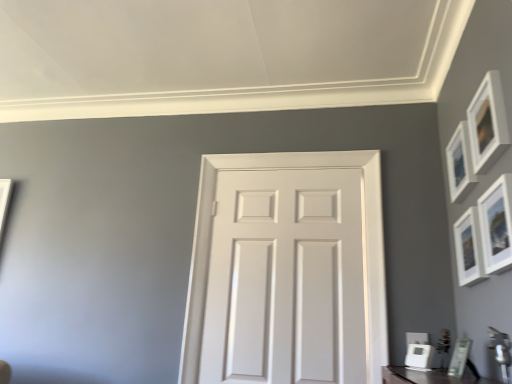
Describe the element at coordinates (364, 233) in the screenshot. I see `white matte door at center` at that location.

Image resolution: width=512 pixels, height=384 pixels. What do you see at coordinates (487, 123) in the screenshot? I see `matte white picture frame at upper right, the first picture frame when ordered from top to bottom` at bounding box center [487, 123].

The image size is (512, 384). What do you see at coordinates (460, 164) in the screenshot?
I see `matte white picture frame at upper right, which is counted as the 5th picture frame, starting from the bottom` at bounding box center [460, 164].

Identify the location of matte white picture frame at lower right, which ranks as the second picture frame in bottom-to-top order. (459, 358).

From the image's perspective, is white matte picture frame at upper right, the fourth picture frame positioned from the top, on matte white picture frame at upper right, arranged as the third picture frame when viewed from the top?

No.

From the matte white picture frame at upper right, arranged as the third picture frame when viewed from the top, count 2nd picture frame to the right and point to it. Please provide its 2D coordinates.

[(468, 249)]

From the image's perspective, which picture frame is the 2nd one above the matte white picture frame at lower right, which ranks as the fifth picture frame in top-to-bottom order? Please provide its 2D coordinates.

[(497, 225)]

Looking at the image, does matte white picture frame at lower right, which ranks as the second picture frame in bottom-to-top order, seem bigger or smaller compared to matte white picture frame at upper right, arranged as the third picture frame when viewed from the top?

Clearly, matte white picture frame at lower right, which ranks as the second picture frame in bottom-to-top order, is smaller in size than matte white picture frame at upper right, arranged as the third picture frame when viewed from the top.

From a real-world perspective, is matte white picture frame at lower right, which ranks as the fifth picture frame in top-to-bottom order, positioned above or below matte white picture frame at upper right, which ranks as the fourth picture frame in bottom-to-top order?

In terms of real-world spatial position, matte white picture frame at lower right, which ranks as the fifth picture frame in top-to-bottom order, is below matte white picture frame at upper right, which ranks as the fourth picture frame in bottom-to-top order.

Which object is thinner, matte white picture frame at lower right, which ranks as the second picture frame in bottom-to-top order, or matte white picture frame at upper right, arranged as the third picture frame when viewed from the top?

With smaller width is matte white picture frame at upper right, arranged as the third picture frame when viewed from the top.

Considering the points (462, 231) and (456, 352), which point is behind, point (462, 231) or point (456, 352)?

The point (456, 352) is behind.

Is white matte picture frame at upper right, the fourth picture frame positioned from the top, taller or shorter than matte white picture frame at lower right, which ranks as the fifth picture frame in top-to-bottom order?

In the image, white matte picture frame at upper right, the fourth picture frame positioned from the top, appears to be taller than matte white picture frame at lower right, which ranks as the fifth picture frame in top-to-bottom order.

Considering the relative sizes of white matte picture frame at upper right, the fourth picture frame positioned from the top, and matte white picture frame at lower right, which ranks as the second picture frame in bottom-to-top order, in the image provided, is white matte picture frame at upper right, the fourth picture frame positioned from the top, bigger than matte white picture frame at lower right, which ranks as the second picture frame in bottom-to-top order,?

Indeed, white matte picture frame at upper right, the fourth picture frame positioned from the top, has a larger size compared to matte white picture frame at lower right, which ranks as the second picture frame in bottom-to-top order.

Is matte white picture frame at upper right, arranged as the third picture frame when viewed from the top, oriented away from white matte picture frame at upper right, the fourth picture frame positioned from the top?

No, matte white picture frame at upper right, arranged as the third picture frame when viewed from the top, is not facing the opposite direction of white matte picture frame at upper right, the fourth picture frame positioned from the top.

There is a white matte picture frame at upper right, which is the third picture frame from bottom to top. Where is `the 1st picture frame below it (from a real-world perspective)`? This screenshot has height=384, width=512. the 1st picture frame below it (from a real-world perspective) is located at coordinates (497, 225).

From a real-world perspective, is matte white picture frame at upper right, which ranks as the fourth picture frame in bottom-to-top order, positioned over white matte picture frame at upper right, the fourth picture frame positioned from the top, based on gravity?

No, from a real-world perspective, matte white picture frame at upper right, which ranks as the fourth picture frame in bottom-to-top order, is not on top of white matte picture frame at upper right, the fourth picture frame positioned from the top.

Is white matte picture frame at upper right, the fourth picture frame positioned from the top, aimed at white matte door at center?

Yes.

Between white matte picture frame at upper right, the fourth picture frame positioned from the top, and white matte door at center, which one has smaller width?

white matte door at center is thinner.

Is white matte picture frame at upper right, which is the third picture frame from bottom to top, placed right next to white matte door at center?

There is a gap between white matte picture frame at upper right, which is the third picture frame from bottom to top, and white matte door at center.

Does point (407, 350) appear closer or farther from the camera than point (463, 273)?

Point (407, 350).

Is white glossy picture frame at lower right, which is counted as the 1th picture frame, starting from the bottom, facing away from white matte picture frame at upper right, the fourth picture frame positioned from the top?

That's not correct — white glossy picture frame at lower right, which is counted as the 1th picture frame, starting from the bottom, is not looking away from white matte picture frame at upper right, the fourth picture frame positioned from the top.

This screenshot has height=384, width=512. What are the coordinates of `the 4th picture frame counting from the left side of the white matte picture frame at upper right, which is the third picture frame from bottom to top` in the screenshot? It's located at (419, 357).

Measure the distance from white glossy picture frame at lower right, which is counted as the 1th picture frame, starting from the bottom, to white matte picture frame at upper right, the fourth picture frame positioned from the top.

white glossy picture frame at lower right, which is counted as the 1th picture frame, starting from the bottom, is 15.79 inches away from white matte picture frame at upper right, the fourth picture frame positioned from the top.

Can matte white picture frame at lower right, which ranks as the second picture frame in bottom-to-top order, be found inside matte white picture frame at upper right, arranged as the third picture frame when viewed from the top?

Definitely not — matte white picture frame at lower right, which ranks as the second picture frame in bottom-to-top order, is not inside matte white picture frame at upper right, arranged as the third picture frame when viewed from the top.

Consider the image. Can you confirm if matte white picture frame at upper right, arranged as the third picture frame when viewed from the top, is taller than matte white picture frame at lower right, which ranks as the fifth picture frame in top-to-bottom order?

Yes, matte white picture frame at upper right, arranged as the third picture frame when viewed from the top, is taller than matte white picture frame at lower right, which ranks as the fifth picture frame in top-to-bottom order.

From a real-world perspective, is matte white picture frame at upper right, which ranks as the fourth picture frame in bottom-to-top order, above or below matte white picture frame at lower right, which ranks as the second picture frame in bottom-to-top order?

In terms of real-world spatial position, matte white picture frame at upper right, which ranks as the fourth picture frame in bottom-to-top order, is above matte white picture frame at lower right, which ranks as the second picture frame in bottom-to-top order.

Locate an element on the screen. Image resolution: width=512 pixels, height=384 pixels. picture frame that is the 1st object directly below the matte white picture frame at upper right, arranged as the third picture frame when viewed from the top (from a real-world perspective) is located at coordinates (459, 358).

Starting from the matte white picture frame at upper right, which ranks as the fourth picture frame in bottom-to-top order, which picture frame is the 3rd one behind? Please provide its 2D coordinates.

[(468, 249)]

From a real-world perspective, starting from the matte white picture frame at lower right, which ranks as the second picture frame in bottom-to-top order, which picture frame is the 1st one vertically above it? Please provide its 2D coordinates.

[(497, 225)]

From the image, which object appears to be nearer to matte white picture frame at lower right, which ranks as the fifth picture frame in top-to-bottom order, matte white picture frame at upper right, arranged as the sixth picture frame when ordered from the bottom, or white matte door at center?

Based on the image, white matte door at center appears to be nearer to matte white picture frame at lower right, which ranks as the fifth picture frame in top-to-bottom order.

Which object lies further to the anchor point matte white picture frame at upper right, which is counted as the 5th picture frame, starting from the bottom, white matte door at center or white glossy picture frame at lower right, which is counted as the 1th picture frame, starting from the bottom?

white glossy picture frame at lower right, which is counted as the 1th picture frame, starting from the bottom, is further to matte white picture frame at upper right, which is counted as the 5th picture frame, starting from the bottom.

Considering their positions, is matte white picture frame at upper right, which ranks as the fourth picture frame in bottom-to-top order, positioned further to white matte picture frame at upper right, which is the third picture frame from bottom to top, than matte white picture frame at upper right, which is counted as the second picture frame, starting from the top?

The object further to white matte picture frame at upper right, which is the third picture frame from bottom to top, is matte white picture frame at upper right, which is counted as the second picture frame, starting from the top.

From the image, which object appears to be farther from matte white picture frame at upper right, arranged as the third picture frame when viewed from the top, white glossy picture frame at lower right, which is counted as the 1th picture frame, starting from the bottom, or white matte door at center?

The object further to matte white picture frame at upper right, arranged as the third picture frame when viewed from the top, is white matte door at center.

Based on their spatial positions, is matte white picture frame at upper right, arranged as the third picture frame when viewed from the top, or white glossy picture frame at lower right, the sixth picture frame viewed from the top, closer to matte white picture frame at lower right, which ranks as the second picture frame in bottom-to-top order?

white glossy picture frame at lower right, the sixth picture frame viewed from the top, is closer to matte white picture frame at lower right, which ranks as the second picture frame in bottom-to-top order.

Looking at the image, which one is located closer to matte white picture frame at lower right, which ranks as the second picture frame in bottom-to-top order, white matte picture frame at upper right, which is the third picture frame from bottom to top, or matte white picture frame at upper right, which is counted as the second picture frame, starting from the top?

white matte picture frame at upper right, which is the third picture frame from bottom to top, is closer to matte white picture frame at lower right, which ranks as the second picture frame in bottom-to-top order.

Considering their positions, is matte white picture frame at upper right, the first picture frame when ordered from top to bottom, positioned closer to white matte door at center than matte white picture frame at upper right, which ranks as the fourth picture frame in bottom-to-top order?

matte white picture frame at upper right, which ranks as the fourth picture frame in bottom-to-top order, is closer to white matte door at center.

Consider the image. Estimate the real-world distances between objects in this image. Which object is further from matte white picture frame at upper right, arranged as the third picture frame when viewed from the top, white matte picture frame at upper right, which is the third picture frame from bottom to top, or matte white picture frame at upper right, which is counted as the second picture frame, starting from the top?

matte white picture frame at upper right, which is counted as the second picture frame, starting from the top, is positioned further to the anchor matte white picture frame at upper right, arranged as the third picture frame when viewed from the top.

Image resolution: width=512 pixels, height=384 pixels. Find the location of `door that lies between matte white picture frame at upper right, the first picture frame when ordered from top to bottom, and white glossy picture frame at lower right, the sixth picture frame viewed from the top, from top to bottom`. door that lies between matte white picture frame at upper right, the first picture frame when ordered from top to bottom, and white glossy picture frame at lower right, the sixth picture frame viewed from the top, from top to bottom is located at coordinates coord(364,233).

Locate an element on the screen. picture frame between white matte picture frame at upper right, which is the third picture frame from bottom to top, and white glossy picture frame at lower right, which is counted as the 1th picture frame, starting from the bottom, in the vertical direction is located at coordinates (459, 358).

The width and height of the screenshot is (512, 384). What are the coordinates of `picture frame between matte white picture frame at upper right, which ranks as the fourth picture frame in bottom-to-top order, and matte white picture frame at lower right, which ranks as the second picture frame in bottom-to-top order, in the up-down direction` in the screenshot? It's located at (468, 249).

I want to click on picture frame between white matte door at center and matte white picture frame at lower right, which ranks as the second picture frame in bottom-to-top order, so tap(419, 357).